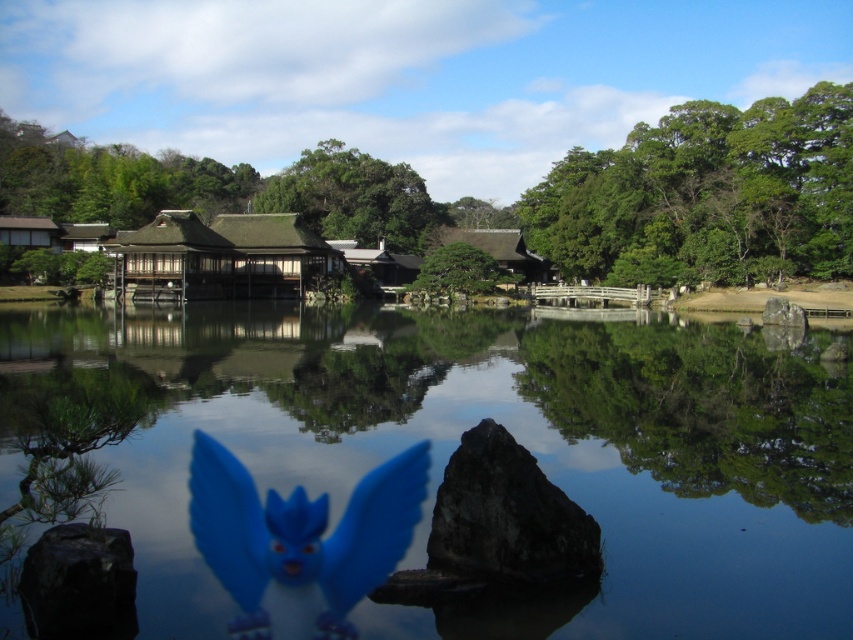
Question: Does transparent water at center appear on the left side of smooth black rock at lower left?

Choices:
 (A) no
 (B) yes

Answer: (A)

Question: Where is blue plastic toy at center located in relation to dark gray rough rock at center in the image?

Choices:
 (A) left
 (B) right

Answer: (A)

Question: Can you confirm if blue plastic toy at center is bigger than green matte tree at center?

Choices:
 (A) yes
 (B) no

Answer: (B)

Question: Considering the real-world distances, which object is farthest from the blue plastic toy at center?

Choices:
 (A) green matte tree at center
 (B) transparent water at center
 (C) green leafy tree at upper right

Answer: (C)

Question: Which object appears closest to the camera in this image?

Choices:
 (A) green leafy tree at center
 (B) green matte tree at center
 (C) gray rough rock at right

Answer: (C)

Question: Among these points, which one is farthest from the camera?

Choices:
 (A) (281, 634)
 (B) (772, 320)
 (C) (328, 212)
 (D) (582, 532)

Answer: (C)